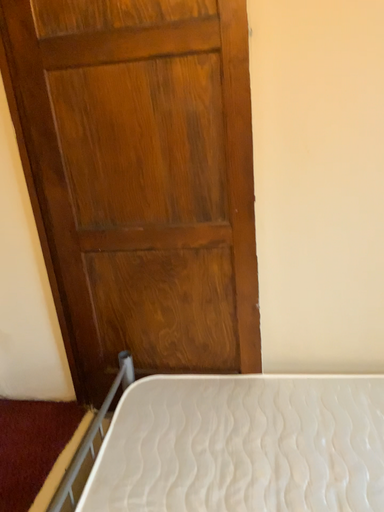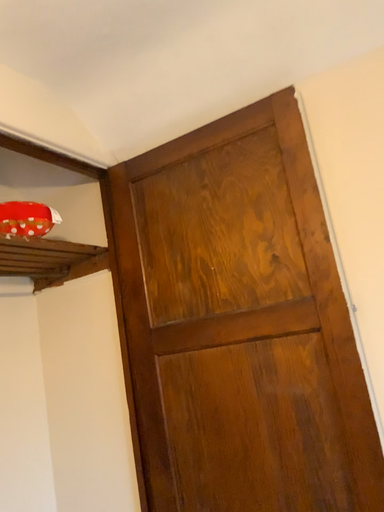
Question: Which way did the camera rotate in the video?

Choices:
 (A) rotated left
 (B) rotated right

Answer: (A)